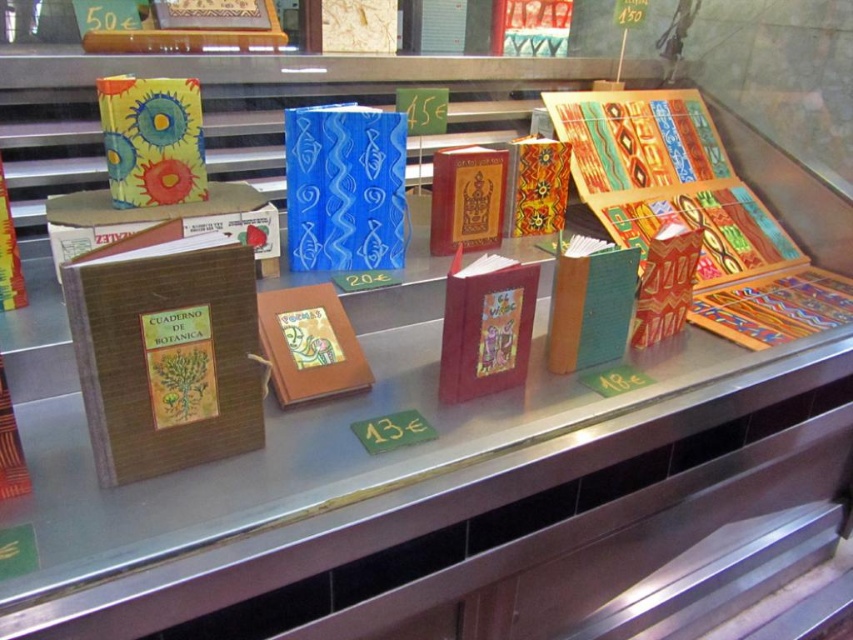
Question: Which point is closer to the camera taking this photo?

Choices:
 (A) (367, 236)
 (B) (138, 161)

Answer: (B)

Question: Which object appears farthest from the camera in this image?

Choices:
 (A) blue paper notebook at center
 (B) watercolor paper notebook at upper left

Answer: (A)

Question: Is blue paper notebook at center wider than watercolor paper notebook at upper left?

Choices:
 (A) yes
 (B) no

Answer: (A)

Question: Which object appears closest to the camera in this image?

Choices:
 (A) blue paper notebook at center
 (B) watercolor paper notebook at upper left

Answer: (B)

Question: Can you confirm if blue paper notebook at center is positioned to the right of watercolor paper notebook at upper left?

Choices:
 (A) no
 (B) yes

Answer: (B)

Question: Is blue paper notebook at center above watercolor paper notebook at upper left?

Choices:
 (A) yes
 (B) no

Answer: (B)